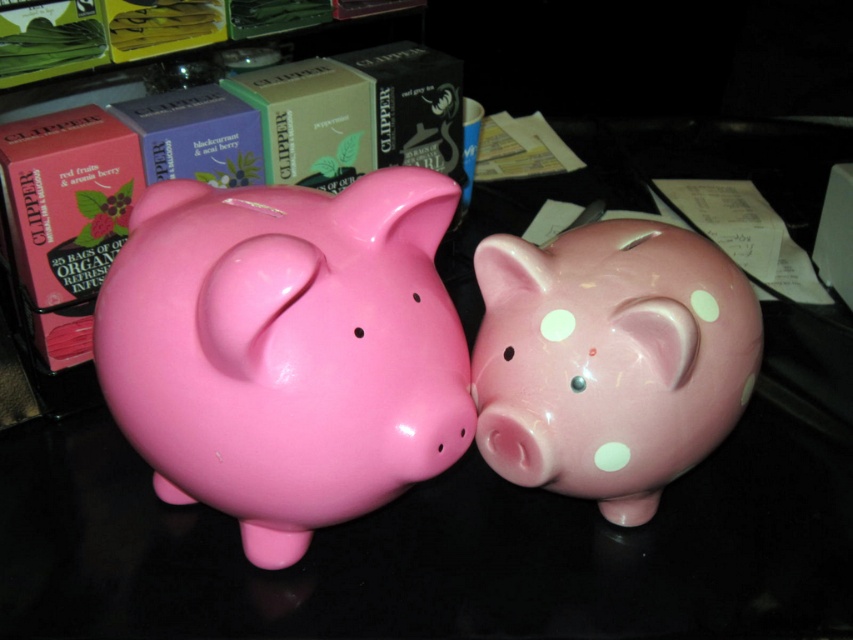
You are standing in front of a table with two piggy banks. You need to place a small gift card exactly where the glossy ceramic piggy bank at center left was originally positioned. What coordinates should you use?

The glossy ceramic piggy bank at center left was positioned at coordinates point (286, 349), so you should place the gift card there.

Looking at this image, you have two piggy banks in front of you, the glossy ceramic piggy bank at center left and the pink glossy piggy bank at center. Which one can hold more coins based on their size?

The glossy ceramic piggy bank at center left is larger in size than the pink glossy piggy bank at center, so it can hold more coins.

You are organizing a shelf and need to place a small toy between the glossy ceramic piggy bank at center left and the pink glossy piggy bank at center. Which piggy bank should you position the toy closer to if you want it to appear closer to the front of the shelf?

The glossy ceramic piggy bank at center left is closer to the viewer, so positioning the toy near it will make it appear closer to the front of the shelf.